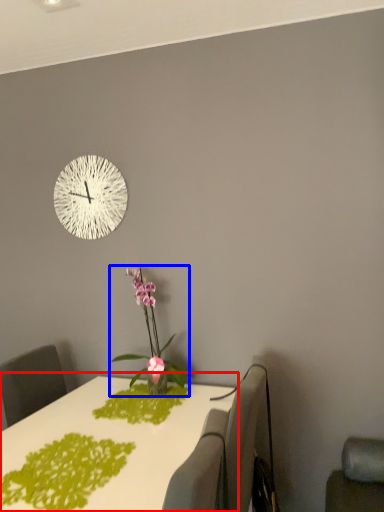
Question: Which point is closer to the camera, table (highlighted by a red box) or houseplant (highlighted by a blue box)?

Choices:
 (A) table
 (B) houseplant

Answer: (A)